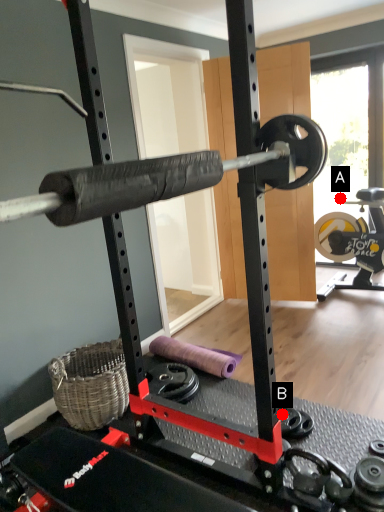
Question: Two points are circled on the image, labeled by A and B beside each circle. Which point appears farthest from the camera in this image?

Choices:
 (A) A is further
 (B) B is further

Answer: (A)